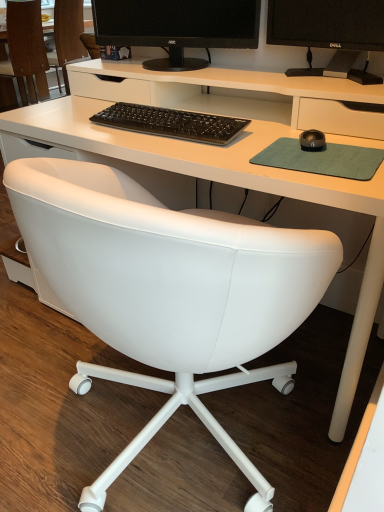
Question: From a real-world perspective, is black glossy monitor at upper right physically above black matte monitor at upper center?

Choices:
 (A) yes
 (B) no

Answer: (B)

Question: From a real-world perspective, is black glossy monitor at upper right located beneath black matte monitor at upper center?

Choices:
 (A) yes
 (B) no

Answer: (A)

Question: Considering the relative sizes of black glossy monitor at upper right and black matte monitor at upper center in the image provided, is black glossy monitor at upper right taller than black matte monitor at upper center?

Choices:
 (A) yes
 (B) no

Answer: (B)

Question: From the image's perspective, is black glossy monitor at upper right on top of black matte monitor at upper center?

Choices:
 (A) yes
 (B) no

Answer: (B)

Question: Is black matte monitor at upper center located within black glossy monitor at upper right?

Choices:
 (A) yes
 (B) no

Answer: (B)

Question: Is green felt mousepad at right bigger or smaller than black matte keyboard at center?

Choices:
 (A) small
 (B) big

Answer: (A)

Question: From a real-world perspective, is green felt mousepad at right physically located above or below black matte keyboard at center?

Choices:
 (A) below
 (B) above

Answer: (A)

Question: From the image's perspective, is green felt mousepad at right above or below black matte keyboard at center?

Choices:
 (A) above
 (B) below

Answer: (B)

Question: Based on their positions, is green felt mousepad at right located to the left or right of black matte keyboard at center?

Choices:
 (A) left
 (B) right

Answer: (B)

Question: Considering the positions of point (321, 136) and point (336, 170), is point (321, 136) closer or farther from the camera than point (336, 170)?

Choices:
 (A) closer
 (B) farther

Answer: (B)

Question: Is black rubberized mouse at center-right in front of or behind green felt mousepad at right in the image?

Choices:
 (A) front
 (B) behind

Answer: (B)

Question: Would you say black rubberized mouse at center-right is inside or outside green felt mousepad at right?

Choices:
 (A) inside
 (B) outside

Answer: (B)

Question: Considering the positions of black rubberized mouse at center-right and green felt mousepad at right in the image, is black rubberized mouse at center-right wider or thinner than green felt mousepad at right?

Choices:
 (A) wide
 (B) thin

Answer: (B)

Question: Is green felt mousepad at right wider or thinner than white leather chair at center, which is the second chair from left to right?

Choices:
 (A) thin
 (B) wide

Answer: (A)

Question: In the image, is green felt mousepad at right positioned in front of or behind white leather chair at center, placed as the 1th chair when sorted from right to left?

Choices:
 (A) front
 (B) behind

Answer: (B)